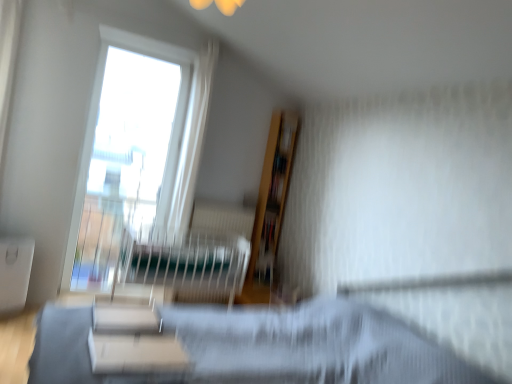
The width and height of the screenshot is (512, 384). Identify the location of empty space that is ontop of white glossy bookshelf at center (from a real-world perspective). (x=124, y=308).